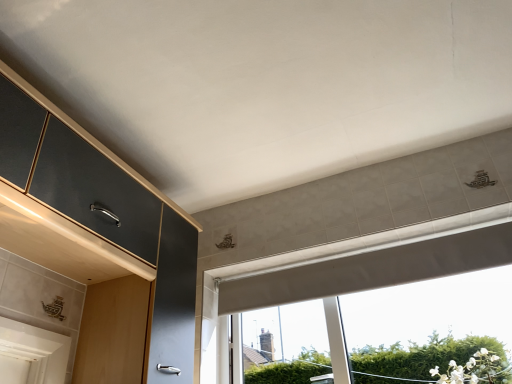
Find the location of a particular element. The width and height of the screenshot is (512, 384). white matte window at center is located at coordinates (377, 263).

What do you see at coordinates (377, 263) in the screenshot? This screenshot has height=384, width=512. I see `white matte window at center` at bounding box center [377, 263].

Find the location of a particular element. The image size is (512, 384). matte black cabinet at left is located at coordinates (98, 242).

Describe the element at coordinates (98, 242) in the screenshot. I see `matte black cabinet at left` at that location.

Find the location of a particular element. This screenshot has height=384, width=512. white matte window at center is located at coordinates (377, 263).

Which object is positioned more to the right, white matte window at center or matte black cabinet at left?

white matte window at center is more to the right.

Relative to matte black cabinet at left, is white matte window at center in front or behind?

In the image, white matte window at center appears behind matte black cabinet at left.

Which is behind, point (372, 257) or point (163, 236)?

The point (372, 257) is behind.

Based on the photo, from the image's perspective, which is below, white matte window at center or matte black cabinet at left?

white matte window at center is shown below in the image.

From a real-world perspective, is white matte window at center physically located above or below matte black cabinet at left?

white matte window at center is below matte black cabinet at left.

Which object is thinner, white matte window at center or matte black cabinet at left?

white matte window at center is thinner.

Between white matte window at center and matte black cabinet at left, which one has less height?

white matte window at center is shorter.

From the picture: Based on their sizes in the image, would you say white matte window at center is bigger or smaller than matte black cabinet at left?

Clearly, white matte window at center is smaller in size than matte black cabinet at left.

Do you think white matte window at center is within matte black cabinet at left, or outside of it?

The correct answer is: outside.

From the picture: Is white matte window at center next to matte black cabinet at left?

No, white matte window at center is not in contact with matte black cabinet at left.

Is white matte window at center oriented away from matte black cabinet at left?

That's not correct — white matte window at center is not looking away from matte black cabinet at left.

How many degrees apart are the facing directions of white matte window at center and matte black cabinet at left?

The angle between the facing direction of white matte window at center and the facing direction of matte black cabinet at left is 90 degrees.

Identify the location of window located on the right of matte black cabinet at left. (377, 263).

Does matte black cabinet at left appear on the left side of white matte window at center?

Correct, you'll find matte black cabinet at left to the left of white matte window at center.

In the image, is matte black cabinet at left positioned in front of or behind white matte window at center?

matte black cabinet at left is in front of white matte window at center.

Which point is more distant from viewer, (2, 225) or (493, 226)?

Positioned behind is point (493, 226).

From the image's perspective, is matte black cabinet at left above or below white matte window at center?

Clearly, from the image's perspective, matte black cabinet at left is above white matte window at center.

From a real-world perspective, is matte black cabinet at left positioned above or below white matte window at center?

Clearly, from a real-world perspective, matte black cabinet at left is above white matte window at center.

Considering the relative sizes of matte black cabinet at left and white matte window at center in the image provided, is matte black cabinet at left thinner than white matte window at center?

Incorrect, the width of matte black cabinet at left is not less than that of white matte window at center.

Who is taller, matte black cabinet at left or white matte window at center?

matte black cabinet at left is taller.

Considering the sizes of objects matte black cabinet at left and white matte window at center in the image provided, who is smaller, matte black cabinet at left or white matte window at center?

white matte window at center is smaller.

Looking at this image, would you say white matte window at center is part of matte black cabinet at left's contents?

No, white matte window at center is not surrounded by matte black cabinet at left.

Is matte black cabinet at left not near white matte window at center?

No, matte black cabinet at left is not far from white matte window at center.

In the scene shown: Is white matte window at center at the back of matte black cabinet at left?

matte black cabinet at left is not turned away from white matte window at center.

Where is `dresser above the white matte window at center (from the image's perspective)`? dresser above the white matte window at center (from the image's perspective) is located at coordinates (98, 242).

Image resolution: width=512 pixels, height=384 pixels. Find the location of `window to the right of matte black cabinet at left`. window to the right of matte black cabinet at left is located at coordinates (377, 263).

You are a GUI agent. You are given a task and a screenshot of the screen. Output one action in this format:
    pyautogui.click(x=<x>, y=<y>)
    Task: Click on the dresser that is on the left side of white matte window at center
    This screenshot has width=512, height=384.
    Given the screenshot: What is the action you would take?
    pyautogui.click(x=98, y=242)